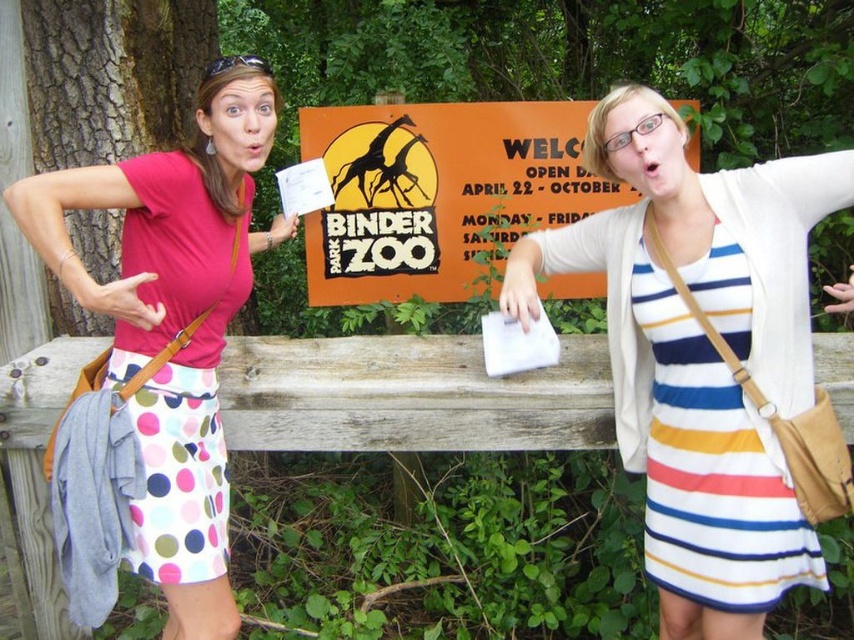
You are a photographer at the zoo and need to capture both the striped cotton dress at center and the orange matte sign at center in a single frame. Based on their positions, which object should you ensure is placed closer to the left side of the camera frame?

The orange matte sign at center should be placed closer to the left side of the camera frame because the striped cotton dress at center is positioned on the right side of it.